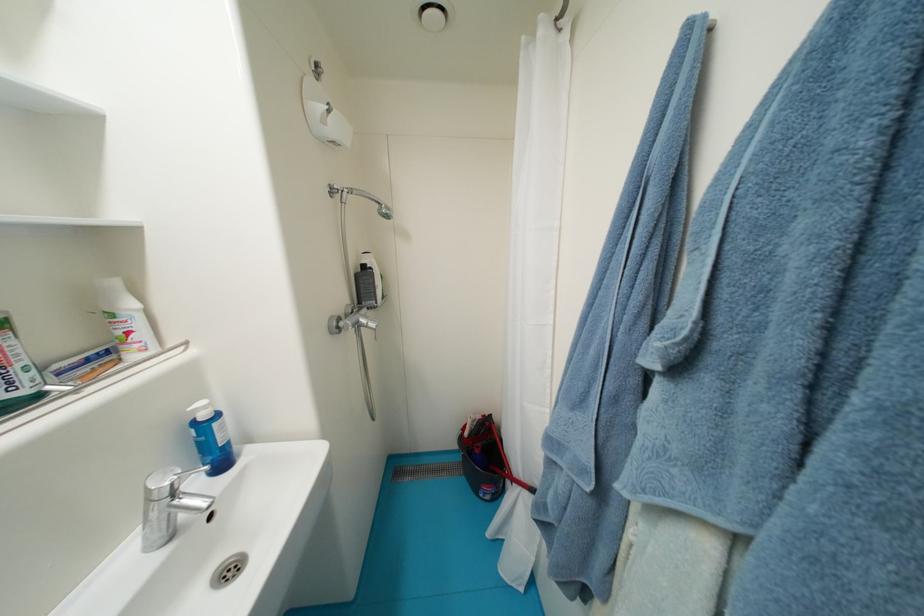
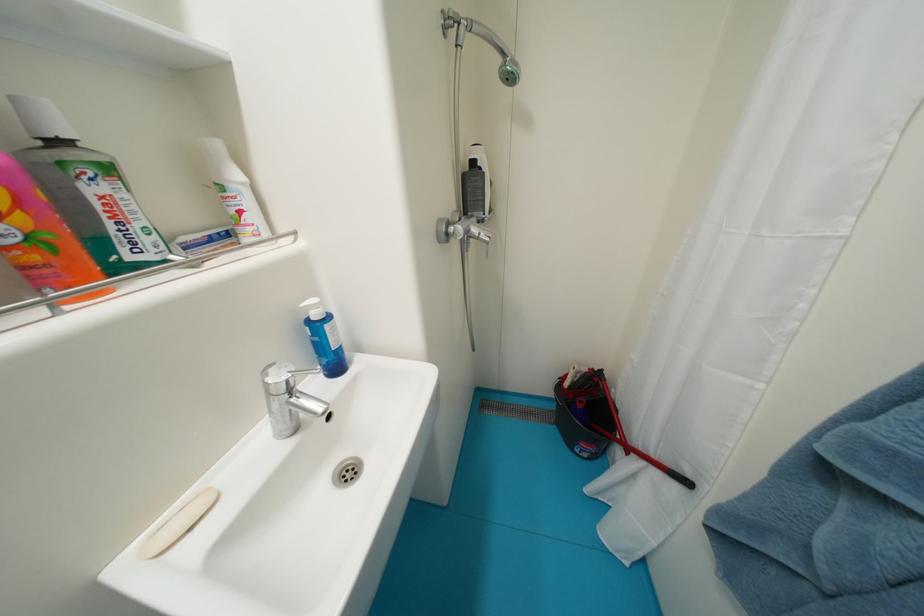
What movement of the cameraman would produce the second image?

The cameraman moved toward left, forward.